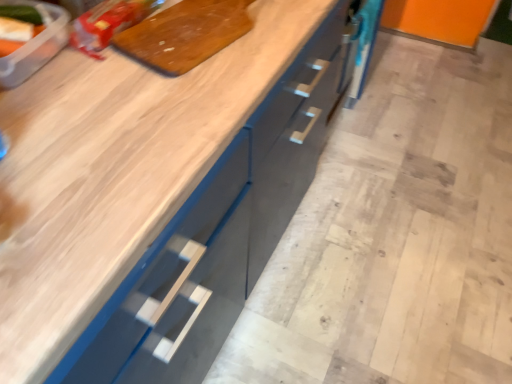
Question: From the image's perspective, would you say matte plastic bag at upper left, which is the second food from front to back, is shown under wooden cutting board at upper center?

Choices:
 (A) no
 (B) yes

Answer: (A)

Question: Is matte plastic bag at upper left, the 1th food viewed from the right, not inside wooden cutting board at upper center?

Choices:
 (A) no
 (B) yes

Answer: (B)

Question: Is matte plastic bag at upper left, which is the second food from front to back, looking in the opposite direction of wooden cutting board at upper center?

Choices:
 (A) no
 (B) yes

Answer: (A)

Question: Is matte plastic bag at upper left, the 1th food viewed from the right, at the right side of wooden cutting board at upper center?

Choices:
 (A) no
 (B) yes

Answer: (A)

Question: Can you confirm if matte plastic bag at upper left, which is the second food from front to back, is smaller than wooden cutting board at upper center?

Choices:
 (A) yes
 (B) no

Answer: (A)

Question: From the image's perspective, is matte plastic bag at upper left, which is the second food from front to back, positioned above or below wooden cutting board at upper center?

Choices:
 (A) above
 (B) below

Answer: (A)

Question: From their relative heights in the image, would you say matte plastic bag at upper left, which is the second food from front to back, is taller or shorter than wooden cutting board at upper center?

Choices:
 (A) tall
 (B) short

Answer: (A)

Question: Does point (100, 49) appear closer or farther from the camera than point (218, 21)?

Choices:
 (A) farther
 (B) closer

Answer: (B)

Question: Looking at their shapes, would you say matte plastic bag at upper left, the second food from the left, is wider or thinner than wooden cutting board at upper center?

Choices:
 (A) thin
 (B) wide

Answer: (A)

Question: Is wooden cutting board at upper center taller or shorter than matte plastic bag at upper left, the second food from the left?

Choices:
 (A) tall
 (B) short

Answer: (B)

Question: Which is correct: wooden cutting board at upper center is inside matte plastic bag at upper left, the 1th food viewed from the right, or outside of it?

Choices:
 (A) inside
 (B) outside

Answer: (B)

Question: From the image's perspective, is wooden cutting board at upper center located above or below matte plastic bag at upper left, the first food viewed from the back?

Choices:
 (A) below
 (B) above

Answer: (A)

Question: Considering their positions, is wooden cutting board at upper center located in front of or behind matte plastic bag at upper left, the first food viewed from the back?

Choices:
 (A) behind
 (B) front

Answer: (B)

Question: Is translucent plastic container at upper left, which is counted as the first food, starting from the front, to the left or to the right of matte plastic bag at upper left, the 1th food viewed from the right, in the image?

Choices:
 (A) right
 (B) left

Answer: (B)

Question: From their relative heights in the image, would you say translucent plastic container at upper left, placed as the second food when sorted from right to left, is taller or shorter than matte plastic bag at upper left, the first food viewed from the back?

Choices:
 (A) short
 (B) tall

Answer: (B)